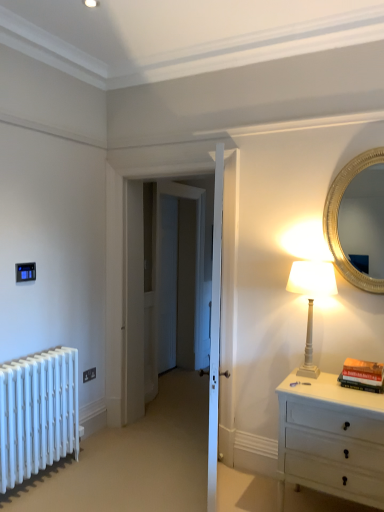
Question: Is black plastic electrical outlet at lower left not within gold metallic mirror at upper right?

Choices:
 (A) yes
 (B) no

Answer: (A)

Question: Does black plastic electrical outlet at lower left have a lesser height compared to gold metallic mirror at upper right?

Choices:
 (A) no
 (B) yes

Answer: (B)

Question: Could you tell me if black plastic electrical outlet at lower left is facing gold metallic mirror at upper right?

Choices:
 (A) yes
 (B) no

Answer: (B)

Question: Considering the relative sizes of black plastic electrical outlet at lower left and gold metallic mirror at upper right in the image provided, is black plastic electrical outlet at lower left bigger than gold metallic mirror at upper right?

Choices:
 (A) yes
 (B) no

Answer: (B)

Question: From the image's perspective, is black plastic electrical outlet at lower left on top of gold metallic mirror at upper right?

Choices:
 (A) yes
 (B) no

Answer: (B)

Question: Considering the positions of hardcover book at right and white glossy table lamp at right in the image, is hardcover book at right wider or thinner than white glossy table lamp at right?

Choices:
 (A) thin
 (B) wide

Answer: (A)

Question: Would you say hardcover book at right is inside or outside white glossy table lamp at right?

Choices:
 (A) inside
 (B) outside

Answer: (B)

Question: Based on their positions, is hardcover book at right located to the left or right of white glossy table lamp at right?

Choices:
 (A) left
 (B) right

Answer: (B)

Question: Considering the positions of hardcover book at right and white glossy table lamp at right in the image, is hardcover book at right taller or shorter than white glossy table lamp at right?

Choices:
 (A) tall
 (B) short

Answer: (B)

Question: From a real-world perspective, is white painted wood chest of drawers at right positioned above or below white metallic radiator at lower left?

Choices:
 (A) above
 (B) below

Answer: (B)

Question: Considering their positions, is white painted wood chest of drawers at right located in front of or behind white metallic radiator at lower left?

Choices:
 (A) behind
 (B) front

Answer: (B)

Question: From their relative heights in the image, would you say white painted wood chest of drawers at right is taller or shorter than white metallic radiator at lower left?

Choices:
 (A) short
 (B) tall

Answer: (A)

Question: Is white painted wood chest of drawers at right wider or thinner than white metallic radiator at lower left?

Choices:
 (A) wide
 (B) thin

Answer: (A)

Question: Considering the positions of white glossy table lamp at right and white metallic radiator at lower left in the image, is white glossy table lamp at right taller or shorter than white metallic radiator at lower left?

Choices:
 (A) short
 (B) tall

Answer: (A)

Question: Looking at their shapes, would you say white glossy table lamp at right is wider or thinner than white metallic radiator at lower left?

Choices:
 (A) wide
 (B) thin

Answer: (A)